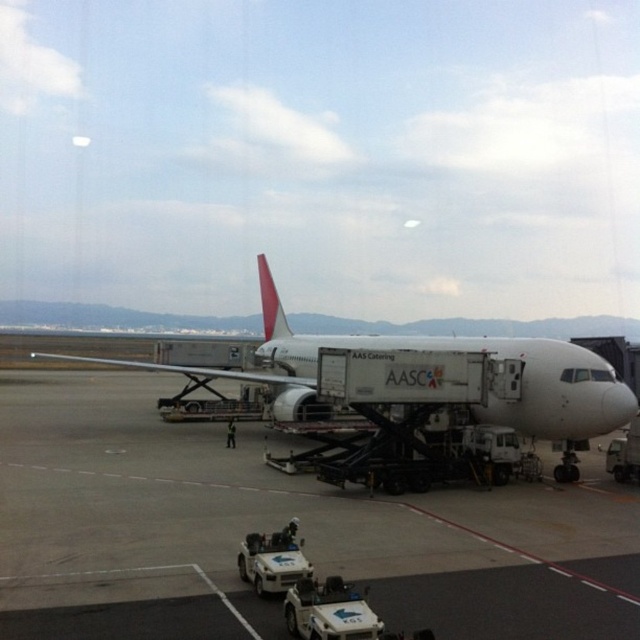
Is point (458, 512) farther from viewer compared to point (371, 336)?

That is False.

What do you see at coordinates (275, 529) in the screenshot? I see `white matte tarmac at center` at bounding box center [275, 529].

Which is in front, point (108, 445) or point (568, 467)?

Point (568, 467) is more forward.

This screenshot has height=640, width=640. In order to click on white matte tarmac at center in this screenshot , I will do `click(275, 529)`.